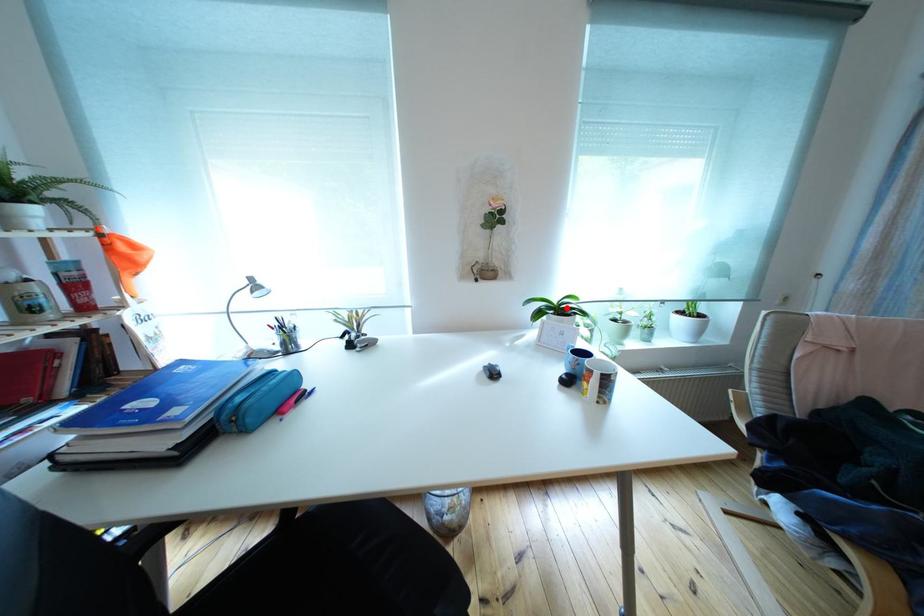
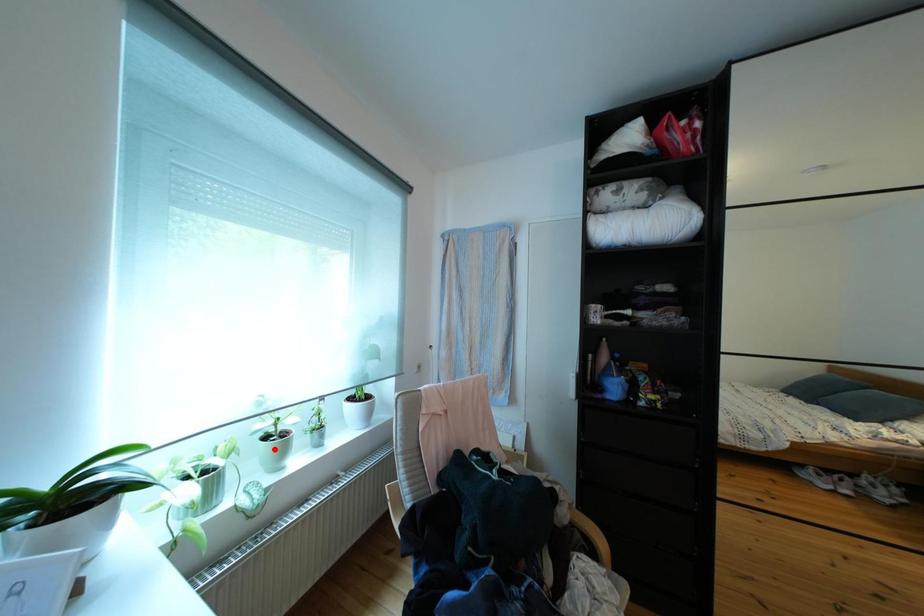
I am providing you with two images of the same scene from different viewpoints. A red point is marked on the first image and another point is marked on the second image. Are the points marked in image1 and image2 representing the same 3D position?

No